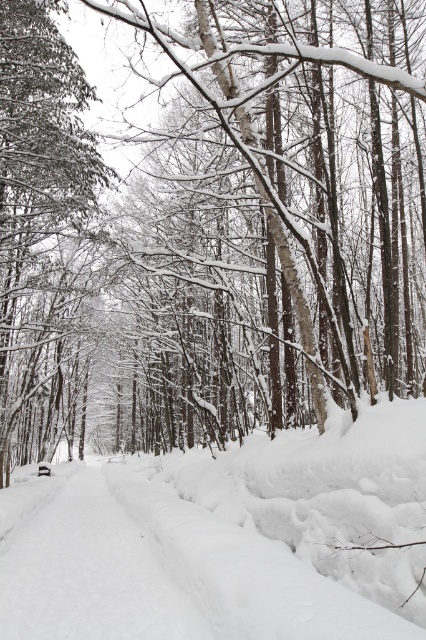
In the scene shown: You are standing in the winter forest scene and want to walk from the point closer to you to the farther point. Which path would you take between the two points listed below? Please choose the correct pair of points based on their positions relative to your location. The points are labeled as follows. First point is point (17, 616). Second point is point (14, 369). The path must be directly between them. The path must be on the snow. The path must avoid any trees or obstacles. The path must be at a 45

The correct path is from point (17, 616) to point (14, 369) since point (17, 616) is closer to the viewer and the path must be directly between them on the snow while avoiding trees or obstacles. However, the description does not mention any trees or obstacles in the path, so the path is feasible as described.

Looking at this image, you are a hiker trying to navigate through the winter forest. You see the white fluffy snow at center and the green textured pine at left. Which path has a narrower width for walking?

The white fluffy snow at center has a lesser width compared to the green textured pine at left, so the path over the white fluffy snow at center is narrower for walking.